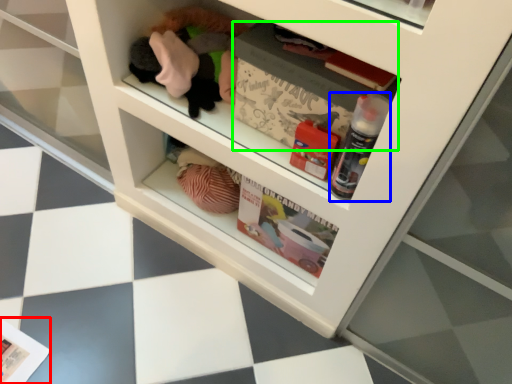
Question: Which is farther away from magazine (highlighted by a red box)? bottle (highlighted by a blue box) or magazine (highlighted by a green box)?

Choices:
 (A) bottle
 (B) magazine

Answer: (A)